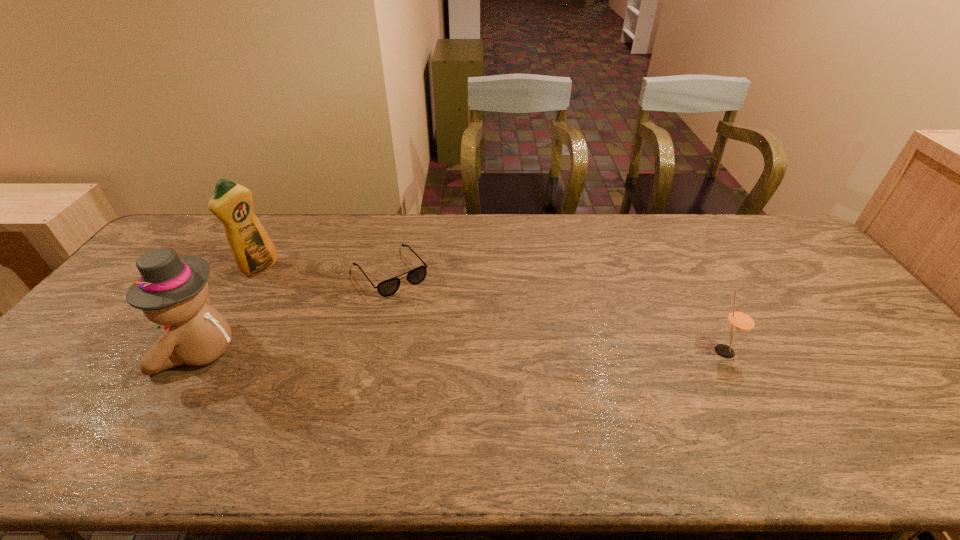
The width and height of the screenshot is (960, 540). In order to click on vacant area situated 0.340m on the front-facing side of the shortest object in this screenshot , I will do `click(471, 370)`.

Locate an element on the screen. The image size is (960, 540). free region located on the front-facing side of the shortest object is located at coordinates (423, 312).

This screenshot has height=540, width=960. In order to click on vacant space situated 0.240m on the front-facing side of the shortest object in this screenshot , I will do `click(451, 345)`.

Where is `vacant region located on the label of the detergent`? vacant region located on the label of the detergent is located at coordinates (351, 316).

Find the location of `vacant space located 0.150m on the label of the detergent`. vacant space located 0.150m on the label of the detergent is located at coordinates (302, 291).

At what (x,y) coordinates should I click in order to perform the action: click on free space located on the label of the detergent. Please return your answer as a coordinate pair (x, y). The image size is (960, 540). Looking at the image, I should click on (322, 301).

The width and height of the screenshot is (960, 540). I want to click on object present at the far edge, so click(388, 287).

The width and height of the screenshot is (960, 540). In order to click on object located in the near edge section of the desktop in this screenshot , I will do `click(172, 291)`.

I want to click on vacant space at the far edge of the desktop, so click(365, 225).

The width and height of the screenshot is (960, 540). What are the coordinates of `blank area at the near edge` in the screenshot? It's located at (839, 396).